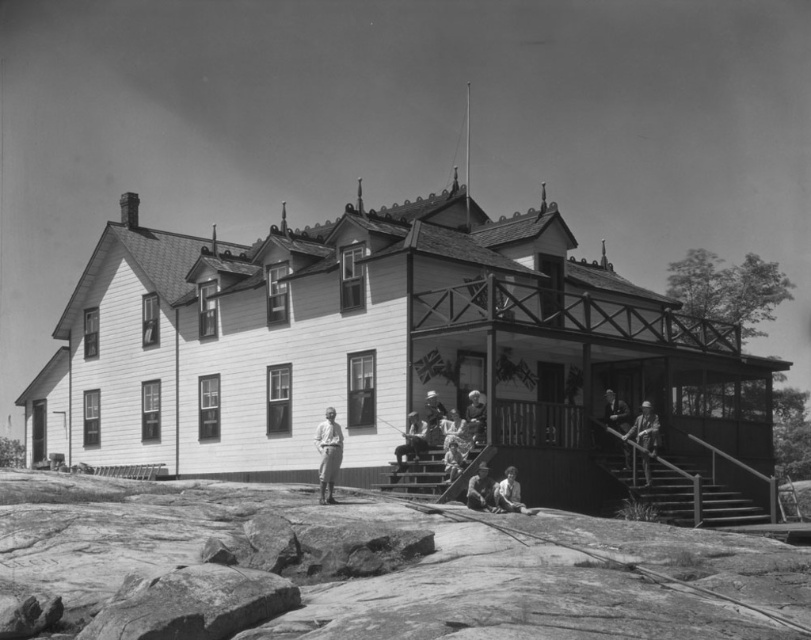
You are standing in front of the two story wooden house and see the wooden helmet at center and the smooth gray shirt at center. Which object is positioned to the right side?

The wooden helmet at center is to the right of the smooth gray shirt at center.

You are standing in front of the house and notice two points marked on the image. The first point is at coordinate point (642, 467) and the second is at point (478, 428). Which point is closer to you?

Point (478, 428) is closer to you because it is less further to the camera than point (642, 467).